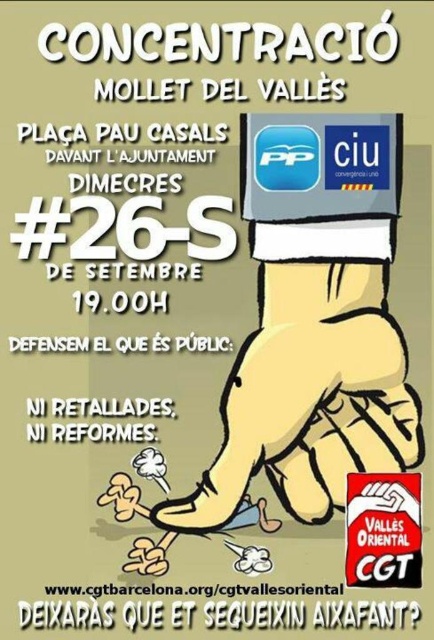
The height and width of the screenshot is (640, 434). What do you see at coordinates (314, 323) in the screenshot?
I see `yellow cartoon hand at center` at bounding box center [314, 323].

The image size is (434, 640). In order to click on yellow cartoon hand at center in this screenshot , I will do `click(314, 323)`.